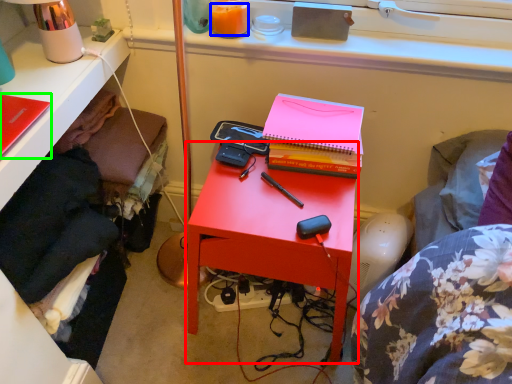
Question: Which object is the closest to the nightstand (highlighted by a red box)? Choose among these: orange juice (highlighted by a blue box) or notebook (highlighted by a green box).

Choices:
 (A) orange juice
 (B) notebook

Answer: (A)